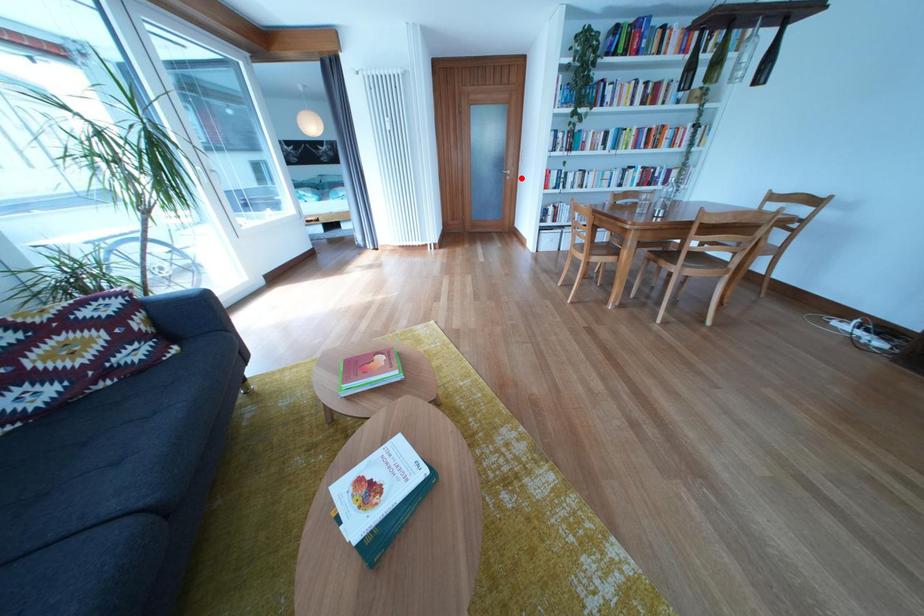
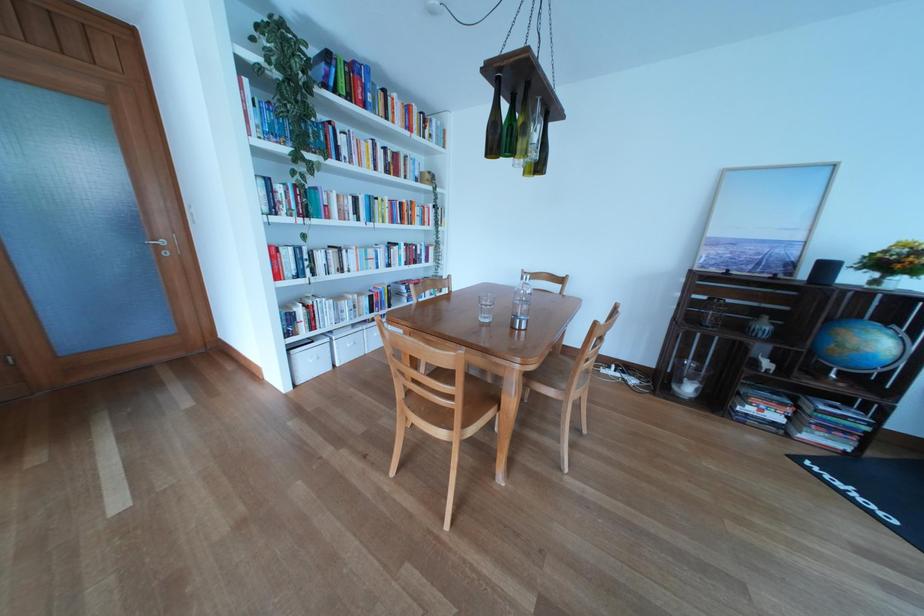
In the second image, find the point that corresponds to the highlighted location in the first image.

(176, 248)